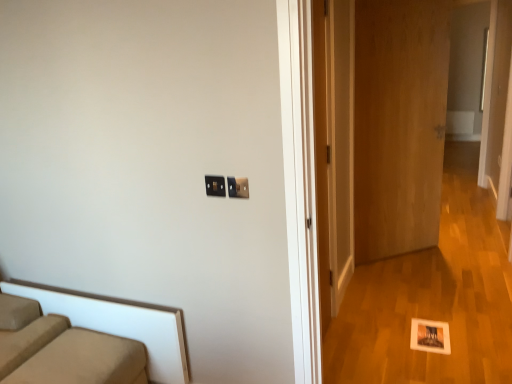
Question: Is wooden door at right, the 2th door viewed from the back, completely or partially outside of wooden door at center, which appears as the 2th door when viewed from the front?

Choices:
 (A) no
 (B) yes

Answer: (B)

Question: From a real-world perspective, is wooden door at right, which is the 1th door in left-to-right order, on top of wooden door at center, the 2th door positioned from the left?

Choices:
 (A) yes
 (B) no

Answer: (B)

Question: Does wooden door at right, which is the 1th door in front-to-back order, appear on the right side of wooden door at center, which ranks as the first door in back-to-front order?

Choices:
 (A) yes
 (B) no

Answer: (B)

Question: Is wooden door at right, which is the 1th door in front-to-back order, facing away from wooden door at center, which appears as the 2th door when viewed from the front?

Choices:
 (A) yes
 (B) no

Answer: (B)

Question: Would you say wooden door at center, which ranks as the first door in back-to-front order, is part of wooden door at right, which is the 1th door in front-to-back order,'s contents?

Choices:
 (A) yes
 (B) no

Answer: (B)

Question: Is wooden door at right, which is the 1th door in left-to-right order, bigger or smaller than beige fabric studio couch at lower left?

Choices:
 (A) small
 (B) big

Answer: (A)

Question: In the image, is wooden door at right, which is the 1th door in left-to-right order, positioned in front of or behind beige fabric studio couch at lower left?

Choices:
 (A) front
 (B) behind

Answer: (B)

Question: From a real-world perspective, is wooden door at right, which is the 1th door in left-to-right order, positioned above or below beige fabric studio couch at lower left?

Choices:
 (A) above
 (B) below

Answer: (A)

Question: From their relative heights in the image, would you say wooden door at right, placed as the second door when sorted from right to left, is taller or shorter than beige fabric studio couch at lower left?

Choices:
 (A) tall
 (B) short

Answer: (A)

Question: Is beige fabric studio couch at lower left taller or shorter than matte black switch at upper center, the first electric outlet positioned from the right?

Choices:
 (A) tall
 (B) short

Answer: (A)

Question: Would you say beige fabric studio couch at lower left is to the left or to the right of matte black switch at upper center, which ranks as the second electric outlet in left-to-right order, in the picture?

Choices:
 (A) right
 (B) left

Answer: (B)

Question: In terms of width, does beige fabric studio couch at lower left look wider or thinner when compared to matte black switch at upper center, which ranks as the second electric outlet in left-to-right order?

Choices:
 (A) wide
 (B) thin

Answer: (A)

Question: From a real-world perspective, is beige fabric studio couch at lower left above or below matte black switch at upper center, the first electric outlet positioned from the right?

Choices:
 (A) below
 (B) above

Answer: (A)

Question: From a real-world perspective, is black plastic electric outlet at center, the second electric outlet viewed from the right, above or below wooden door at center, which is counted as the first door, starting from the right?

Choices:
 (A) above
 (B) below

Answer: (A)

Question: Considering their positions, is black plastic electric outlet at center, the 1th electric outlet when ordered from left to right, located in front of or behind wooden door at center, which ranks as the first door in back-to-front order?

Choices:
 (A) front
 (B) behind

Answer: (A)